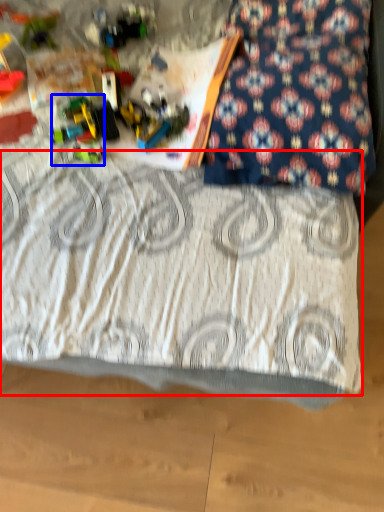
Question: Which of the following is the farthest to the observer, bedding (highlighted by a red box) or toy (highlighted by a blue box)?

Choices:
 (A) bedding
 (B) toy

Answer: (B)